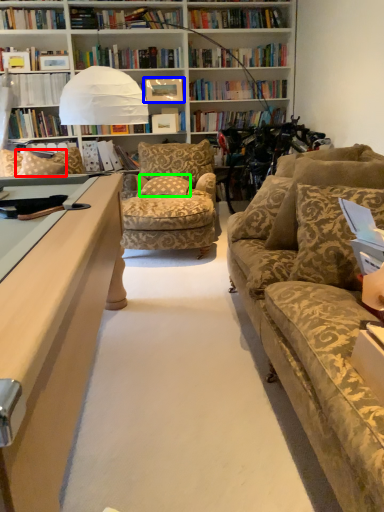
Question: Estimate the real-world distances between objects in this image. Which object is farther from pillow (highlighted by a red box), paperback book (highlighted by a blue box) or pillow (highlighted by a green box)?

Choices:
 (A) paperback book
 (B) pillow

Answer: (A)